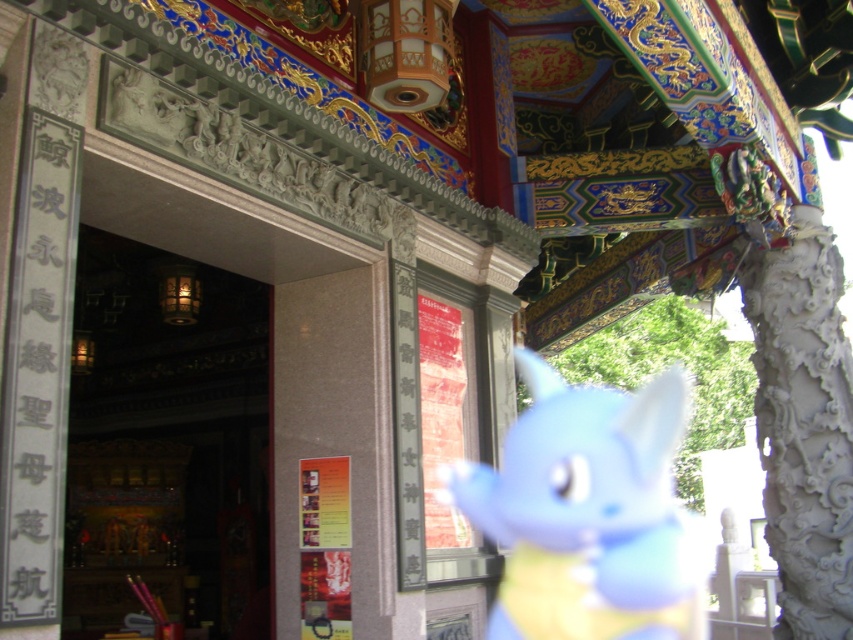
Between wooden carved door at center and blue plush toy at center, which one appears on the right side from the viewer's perspective?

blue plush toy at center is more to the right.

Does wooden carved door at center appear on the right side of blue plush toy at center?

In fact, wooden carved door at center is to the left of blue plush toy at center.

What do you see at coordinates (166, 442) in the screenshot? This screenshot has width=853, height=640. I see `wooden carved door at center` at bounding box center [166, 442].

Find the location of a particular element. The width and height of the screenshot is (853, 640). wooden carved door at center is located at coordinates (166, 442).